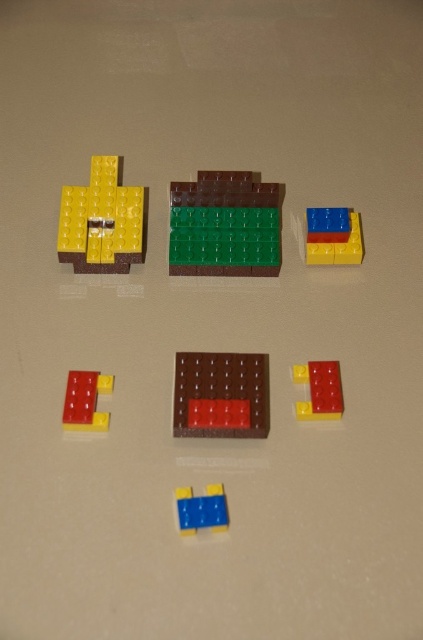
You are a child trying to build a tower using the rubberized blue and red blocks at upper right and the rubberized red brick at lower left. Which object should you pick first to start your tower if you want the base to be closer to you?

You should pick the rubberized blue and red blocks at upper right first because it is closer to you than the rubberized red brick at lower left, making it the better choice for the base of your tower.

You are a child trying to build a tower using the yellow matte brick at upper left and the brown matte rectangular block at center. Which one should you place first to ensure the tower remains stable?

You should place the brown matte rectangular block at center first because it is behind the yellow matte brick at upper left, providing a stable base for the tower.

You are trying to build a tower using the rubberized blue and red blocks at upper right and the blue plastic brick at lower center. Which block should you place first to ensure stability?

The blue plastic brick at lower center should be placed first as it is positioned to the left of the rubberized blue and red blocks at upper right, providing a stable base for the tower.